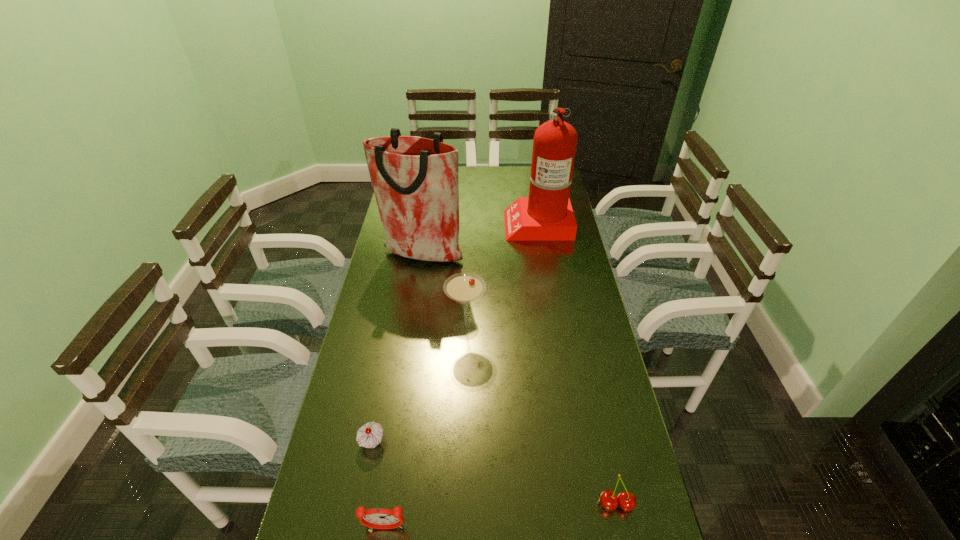
Image resolution: width=960 pixels, height=540 pixels. I want to click on vacant space at the right edge, so click(584, 262).

Where is `free spot between the cupcake and the third farthest object`? The height and width of the screenshot is (540, 960). free spot between the cupcake and the third farthest object is located at coordinates (420, 386).

You are a GUI agent. You are given a task and a screenshot of the screen. Output one action in this format:
    pyautogui.click(x=<x>, y=<y>)
    Task: Click on the free spot between the cherry and the fire extinguisher
    The image size is (960, 540).
    Given the screenshot: What is the action you would take?
    pyautogui.click(x=577, y=363)

The height and width of the screenshot is (540, 960). Find the location of `vacant area that lies between the third tallest object and the fourth farthest object`. vacant area that lies between the third tallest object and the fourth farthest object is located at coordinates (420, 386).

I want to click on free space between the grocery bag and the second nearest object, so click(519, 380).

At what (x,y) coordinates should I click in order to perform the action: click on vacant region between the fifth farthest object and the fourth farthest object. Please return your answer as a coordinate pair (x, y). The height and width of the screenshot is (540, 960). Looking at the image, I should click on (494, 473).

Locate an element on the screen. Image resolution: width=960 pixels, height=540 pixels. free spot between the third tallest object and the cherry is located at coordinates (541, 417).

Image resolution: width=960 pixels, height=540 pixels. In order to click on empty location between the alarm clock and the fourth shortest object in this screenshot , I will do `click(425, 429)`.

This screenshot has height=540, width=960. Find the location of `unoccupied area between the grocery bag and the cupcake`. unoccupied area between the grocery bag and the cupcake is located at coordinates click(x=397, y=349).

What are the coordinates of `object that is the fifth closest one to the fire extinguisher` in the screenshot? It's located at (378, 518).